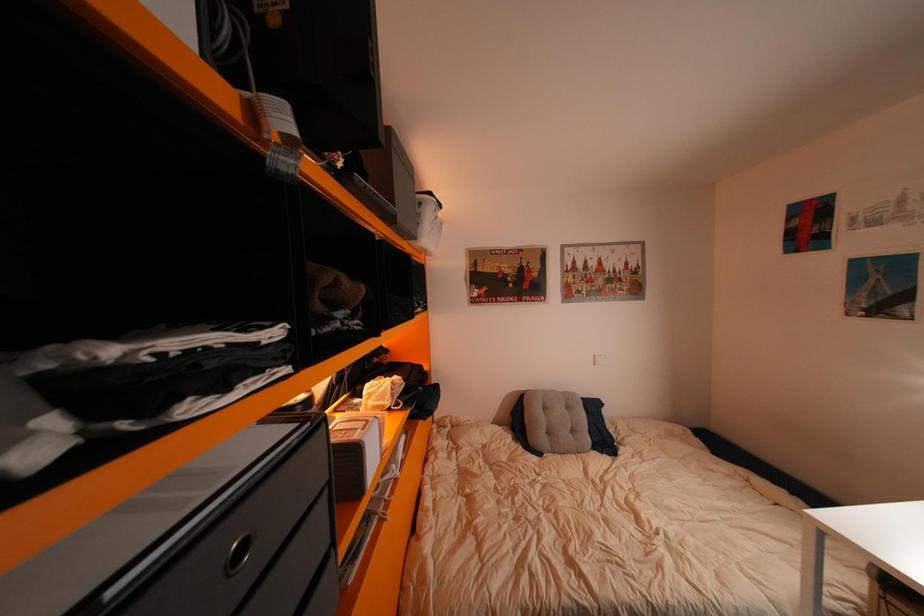
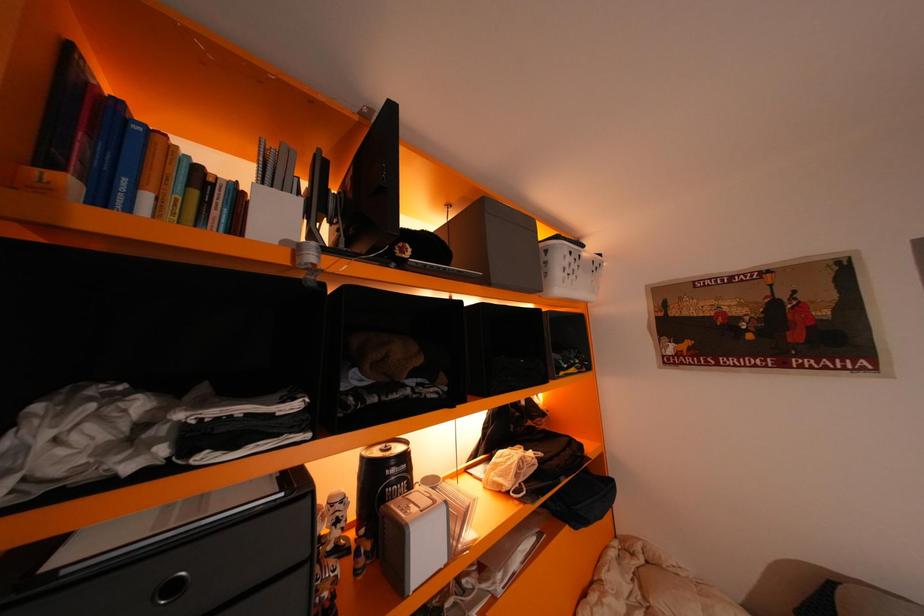
Question: The images are taken continuously from a first-person perspective. In which direction is your viewpoint rotating?

Choices:
 (A) Left
 (B) Right
 (C) Up
 (D) Down

Answer: (A)